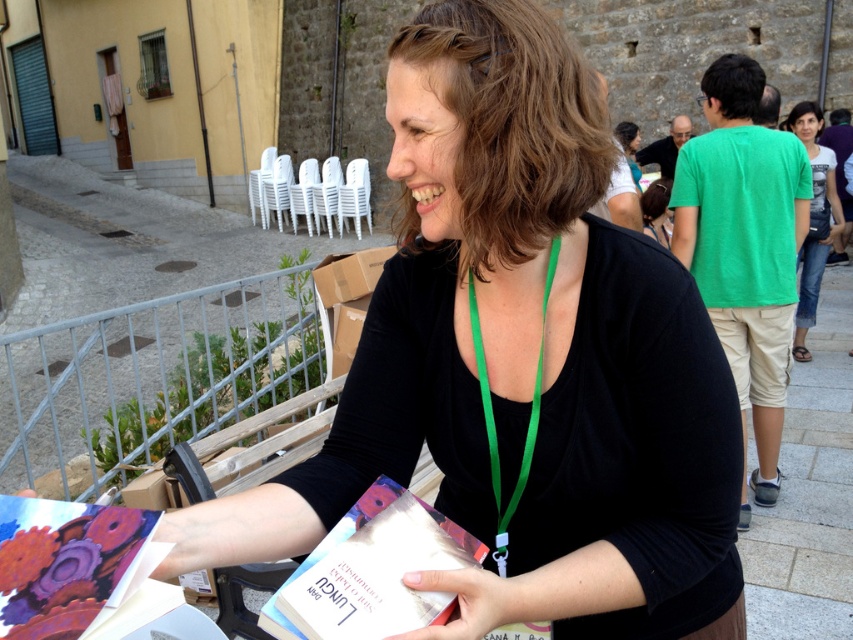
You are standing at the front of the scene and want to pick up an item. Which item is easier to reach without moving your feet? The metallic gear design book at lower left or the denim jeans at right?

The metallic gear design book at lower left is closer to the viewer than the denim jeans at right, so it is easier to reach without moving your feet.

Where is the black matte shirt at center located in the image?

The black matte shirt at center is located at point (521, 362) in the image.